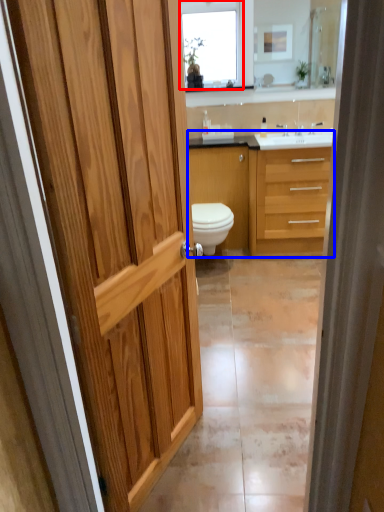
Question: Which point is further to the camera, window (highlighted by a red box) or bathroom cabinet (highlighted by a blue box)?

Choices:
 (A) window
 (B) bathroom cabinet

Answer: (A)